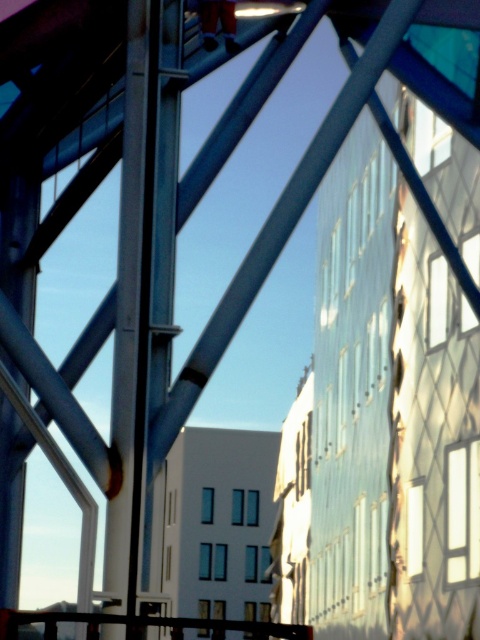
Question: Is metallic pole at center to the left of black metal rail at lower center from the viewer's perspective?

Choices:
 (A) no
 (B) yes

Answer: (B)

Question: From the image, what is the correct spatial relationship of metallic pole at center in relation to black metal rail at lower center?

Choices:
 (A) below
 (B) above

Answer: (B)

Question: Which point is closer to the camera taking this photo?

Choices:
 (A) (134, 435)
 (B) (310, 634)

Answer: (B)

Question: Which point is closer to the camera?

Choices:
 (A) (132, 576)
 (B) (252, 621)

Answer: (A)

Question: Does metallic pole at center have a larger size compared to black metal rail at lower center?

Choices:
 (A) yes
 (B) no

Answer: (B)

Question: Which of the following is the closest to the observer?

Choices:
 (A) metallic pole at center
 (B) black metal rail at lower center

Answer: (B)